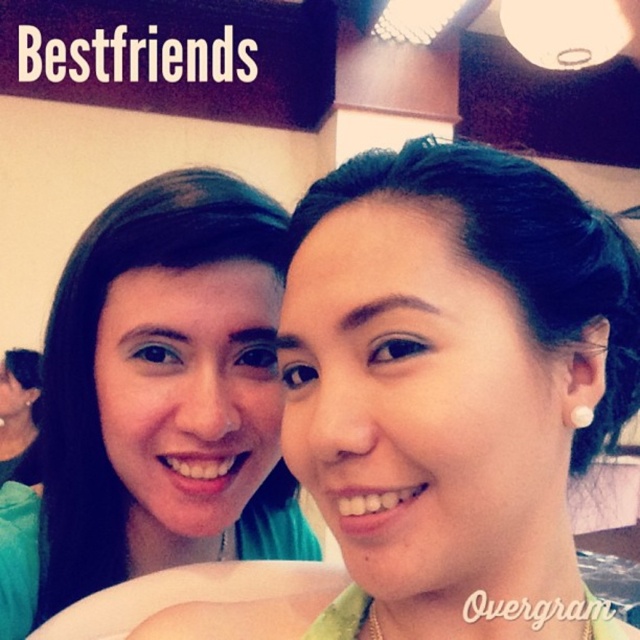
Based on the photo, can you confirm if matte green shirt at center is smaller than matte green shirt at left?

Indeed, matte green shirt at center has a smaller size compared to matte green shirt at left.

Is matte green shirt at center in front of matte green shirt at left?

Yes.

Where is `matte green shirt at center`? Image resolution: width=640 pixels, height=640 pixels. matte green shirt at center is located at coordinates click(x=452, y=378).